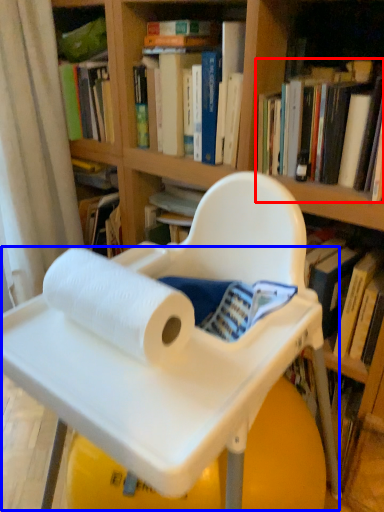
Question: Which object is further to the camera taking this photo, book (highlighted by a red box) or table (highlighted by a blue box)?

Choices:
 (A) book
 (B) table

Answer: (A)